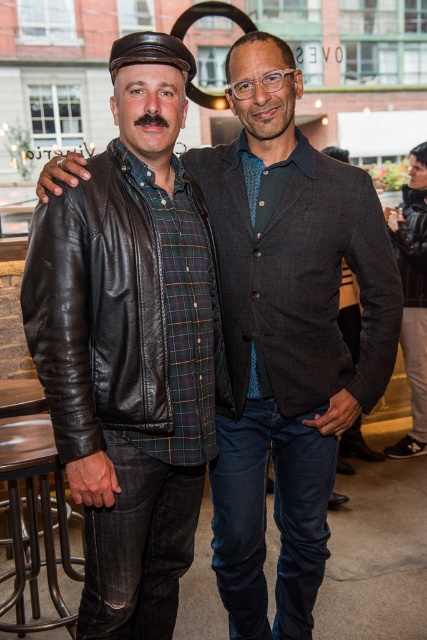
Does point (108, 285) lie in front of point (43, 497)?

Yes, point (108, 285) is closer to viewer.

Can you confirm if shiny black leather jacket at left is smaller than metallic silver stool at lower left?

Indeed, shiny black leather jacket at left has a smaller size compared to metallic silver stool at lower left.

This screenshot has height=640, width=427. I want to click on shiny black leather jacket at left, so click(x=98, y=310).

How far apart are metallic silver stool at lower left and leather jacket at lower right?

They are 7.25 feet apart.

Does metallic silver stool at lower left appear on the right side of leather jacket at lower right?

No, metallic silver stool at lower left is not to the right of leather jacket at lower right.

Between point (8, 458) and point (392, 220), which one is positioned in front?

Positioned in front is point (8, 458).

Where is `metallic silver stool at lower left`? Image resolution: width=427 pixels, height=640 pixels. metallic silver stool at lower left is located at coordinates (35, 515).

Is point (75, 268) farther from camera compared to point (412, 160)?

That is False.

Can you confirm if shiny black leather jacket at left is positioned to the right of leather jacket at lower right?

No, shiny black leather jacket at left is not to the right of leather jacket at lower right.

You are a GUI agent. You are given a task and a screenshot of the screen. Output one action in this format:
    pyautogui.click(x=<x>, y=<y>)
    Task: Click on the shiny black leather jacket at left
    This screenshot has height=640, width=427.
    Given the screenshot: What is the action you would take?
    pyautogui.click(x=98, y=310)

At what (x,y) coordinates should I click in order to perform the action: click on shiny black leather jacket at left. Please return your answer as a coordinate pair (x, y). The width and height of the screenshot is (427, 640). Looking at the image, I should click on (98, 310).